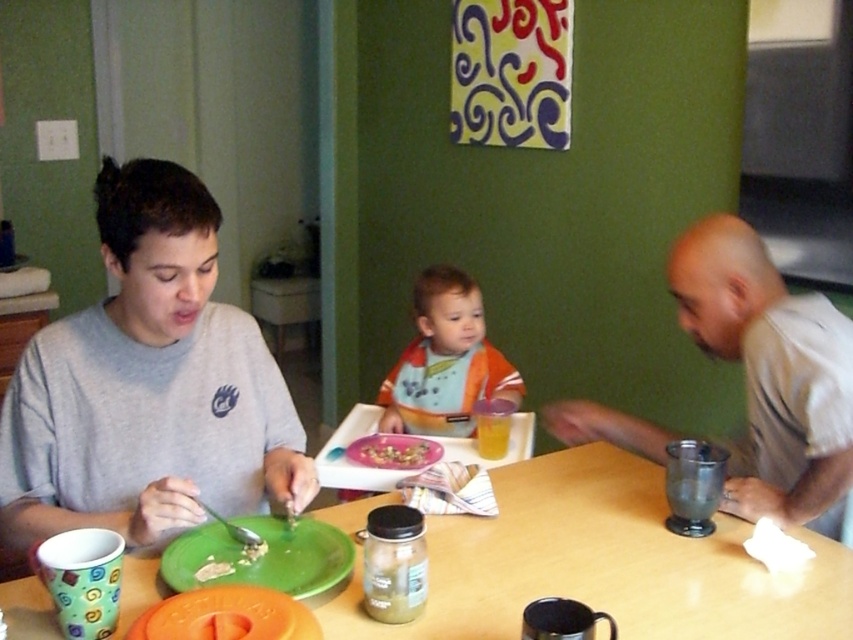
Is metallic silver cup at right positioned behind green plastic plate at lower left?

Yes.

Who is more distant from viewer, (738, 504) or (219, 576)?

The point (738, 504) is behind.

Between point (801, 381) and point (238, 522), which one is positioned in front?

Positioned in front is point (238, 522).

This screenshot has height=640, width=853. Identify the location of metallic silver cup at right. (770, 372).

Is orange bibbed baby at center shorter than green plastic plate at lower left?

In fact, orange bibbed baby at center may be taller than green plastic plate at lower left.

The width and height of the screenshot is (853, 640). I want to click on orange bibbed baby at center, so click(x=445, y=362).

Looking at this image, which of these two, orange bibbed baby at center or shiny plastic tray at center, stands taller?

With more height is orange bibbed baby at center.

Does orange bibbed baby at center appear over shiny plastic tray at center?

Yes.

What do you see at coordinates (445, 362) in the screenshot? I see `orange bibbed baby at center` at bounding box center [445, 362].

The width and height of the screenshot is (853, 640). I want to click on orange bibbed baby at center, so click(x=445, y=362).